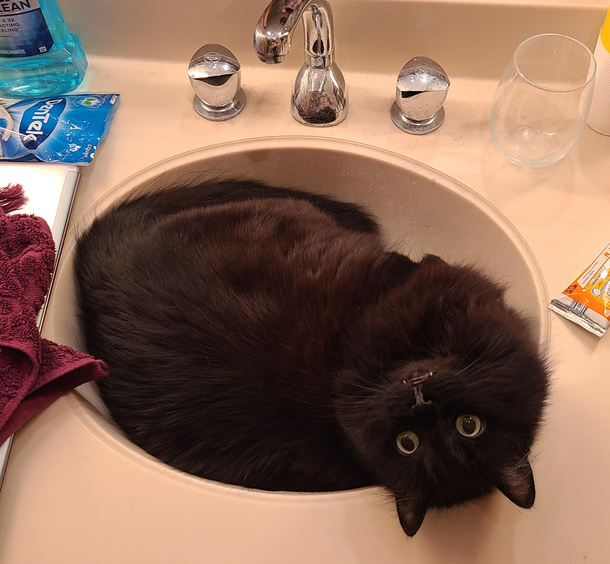
What are the coordinates of `counter top` in the screenshot? It's located at tap(102, 533), tap(568, 532), tap(554, 218).